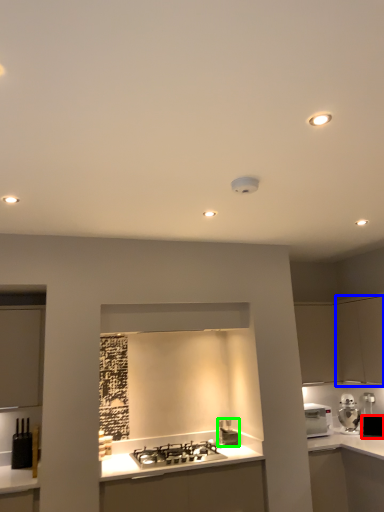
Question: Which object is positioned farthest from appliance (highlighted by a red box)? Select from cabinetry (highlighted by a blue box) and appliance (highlighted by a green box).

Choices:
 (A) cabinetry
 (B) appliance

Answer: (B)